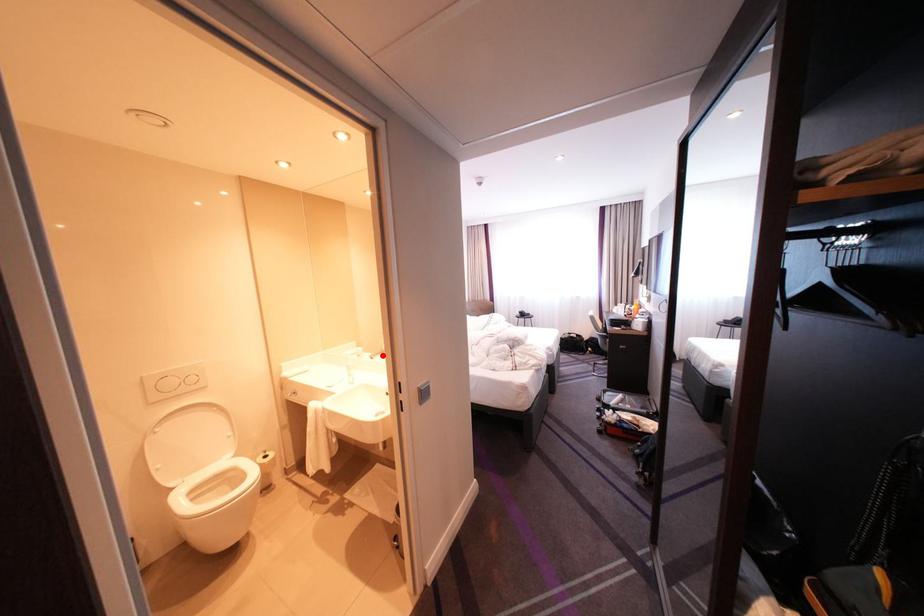
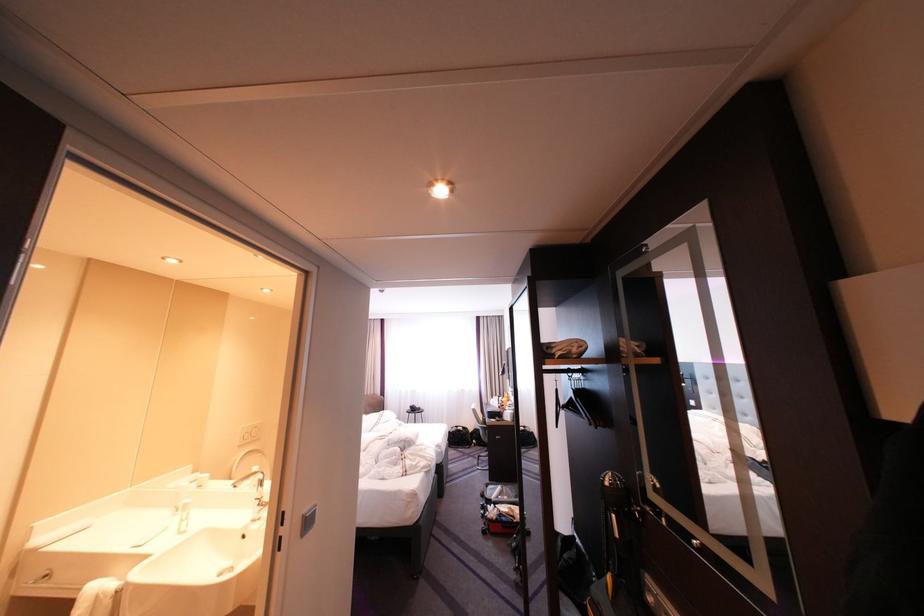
Question: I am providing you with two images of the same scene from different viewpoints. A red point is shown in image1. For the corresponding object point in image2, is it positioned nearer or farther from the camera?

Choices:
 (A) Nearer
 (B) Farther

Answer: (A)